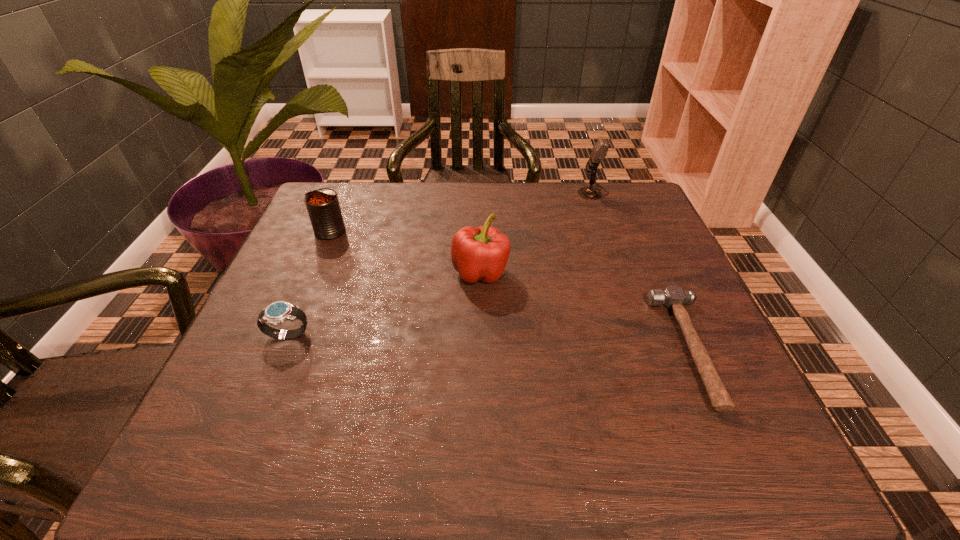
Identify the location of microphone that is positioned at the right edge. (600, 149).

You are a GUI agent. You are given a task and a screenshot of the screen. Output one action in this format:
    pyautogui.click(x=<x>, y=<y>)
    Task: Click on the hammer present at the right edge
    
    Given the screenshot: What is the action you would take?
    pyautogui.click(x=673, y=297)

This screenshot has width=960, height=540. Identify the location of object at the far left corner. (323, 207).

This screenshot has width=960, height=540. Identify the location of object that is at the far right corner. (600, 149).

In the image, there is a desktop. Where is `free space at the far edge`? This screenshot has width=960, height=540. free space at the far edge is located at coordinates [x=438, y=210].

Identify the location of vacant space at the near edge of the desktop. (416, 464).

In the image, there is a desktop. Identify the location of vacant space at the left edge. (300, 409).

Identify the location of vacant space at the right edge. (644, 260).

Find the location of `vacant area at the far right corner`. vacant area at the far right corner is located at coordinates (615, 190).

Find the location of a particular element. free space between the tallest object and the second shortest object is located at coordinates (441, 264).